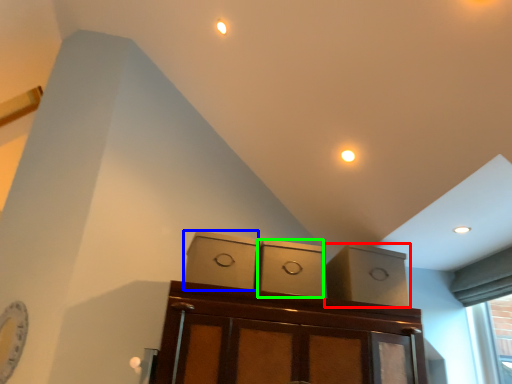
Question: Based on their relative distances, which object is farther from cabinetry (highlighted by a red box)? Choose from cabinetry (highlighted by a blue box) and cabinetry (highlighted by a green box).

Choices:
 (A) cabinetry
 (B) cabinetry

Answer: (A)